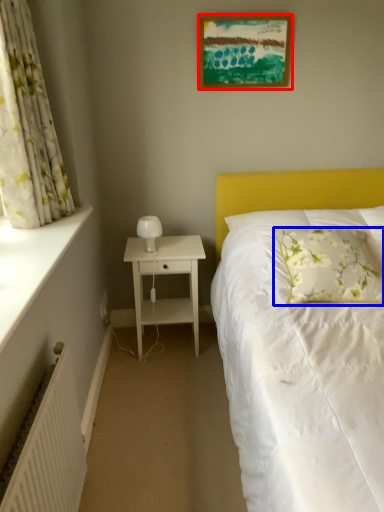
Question: Which object is closer to the camera taking this photo, picture frame (highlighted by a red box) or pillow (highlighted by a blue box)?

Choices:
 (A) picture frame
 (B) pillow

Answer: (B)